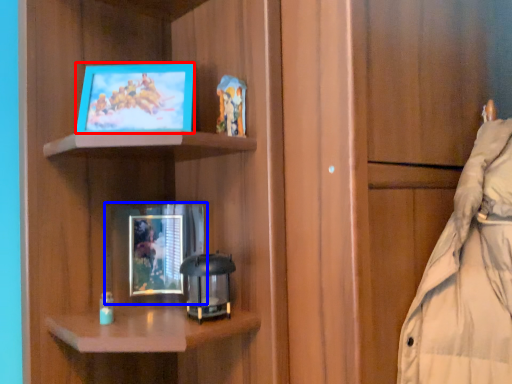
Question: Which object appears farthest to the camera in this image, picture frame (highlighted by a red box) or picture frame (highlighted by a blue box)?

Choices:
 (A) picture frame
 (B) picture frame

Answer: (B)